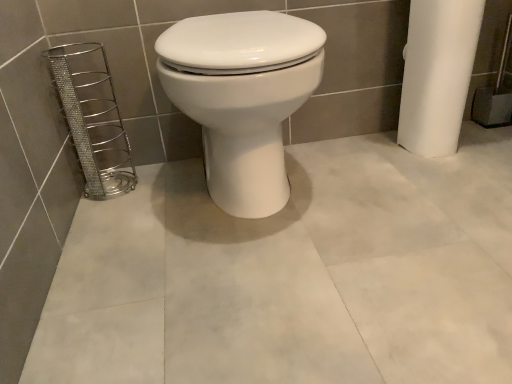
Find the location of a particular element. The height and width of the screenshot is (384, 512). vacant space that's between white glossy toilet at center and silver metallic wire basket at left is located at coordinates (147, 200).